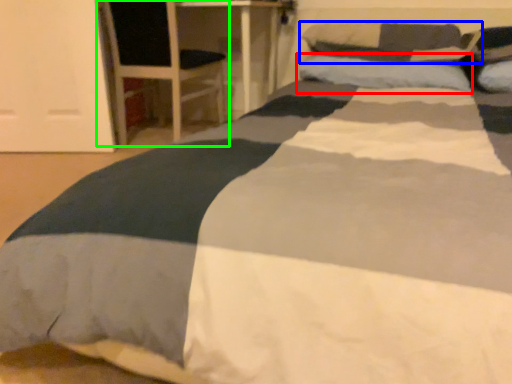
Question: Estimate the real-world distances between objects in this image. Which object is closer to pillow (highlighted by a red box), pillow (highlighted by a blue box) or armchair (highlighted by a green box)?

Choices:
 (A) pillow
 (B) armchair

Answer: (A)